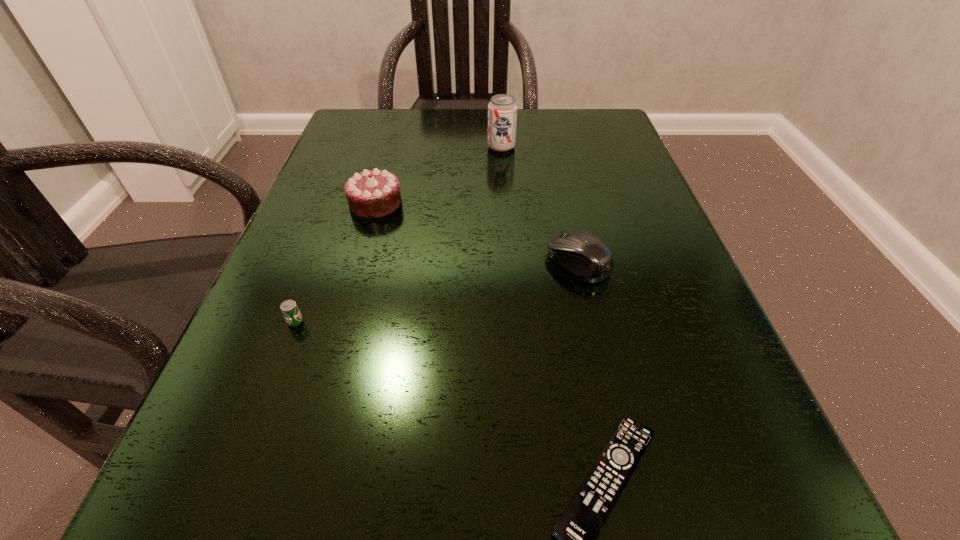
Identify the location of the farthest object. The width and height of the screenshot is (960, 540). (502, 110).

Identify the location of the right beer can. The width and height of the screenshot is (960, 540). (502, 110).

Find the location of a particular element. This screenshot has height=540, width=960. the fourth shortest object is located at coordinates point(375,193).

Where is `chocolate cake`? The width and height of the screenshot is (960, 540). chocolate cake is located at coordinates (375, 193).

Identify the location of the third shortest object. The width and height of the screenshot is (960, 540). (582, 254).

At what (x,y) coordinates should I click in order to perform the action: click on mouse. Please return your answer as a coordinate pair (x, y). Looking at the image, I should click on (582, 254).

At what (x,y) coordinates should I click in order to perform the action: click on the fourth farthest object. Please return your answer as a coordinate pair (x, y). Looking at the image, I should click on (289, 308).

Locate an element on the screen. This screenshot has width=960, height=540. the nearer beer can is located at coordinates (289, 308).

The width and height of the screenshot is (960, 540). I want to click on vacant position located on the front of the right beer can, so coord(510,268).

Identify the location of free spot located 0.200m on the back of the fourth nearest object. The image size is (960, 540). (395, 138).